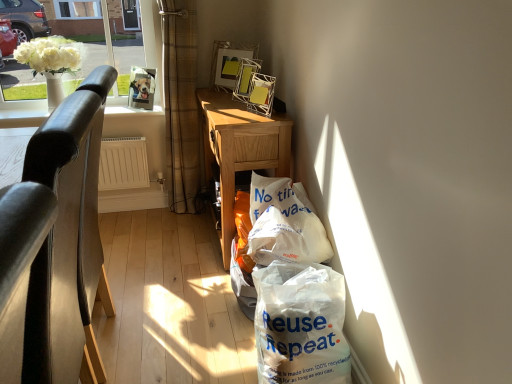
Locate an element on the screen. The width and height of the screenshot is (512, 384). free space to the left of wooden desk at center is located at coordinates (157, 242).